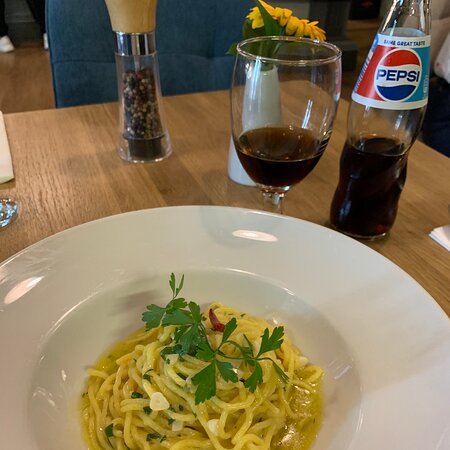
You are a GUI agent. You are given a task and a screenshot of the screen. Output one action in this format:
    pyautogui.click(x=<x>, y=<y>)
    Task: Click on the 1 glass
    This screenshot has width=450, height=450.
    Given the screenshot: What is the action you would take?
    pyautogui.click(x=311, y=128)